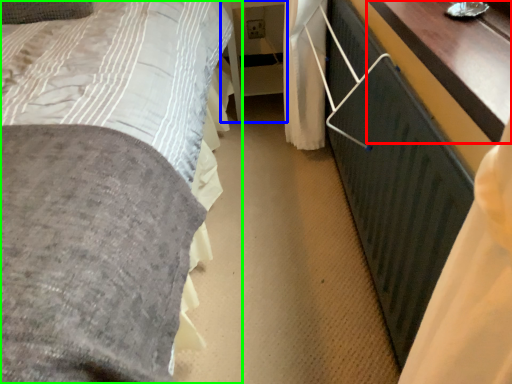
Question: Based on their relative distances, which object is farther from table (highlighted by a red box)? Choose from table (highlighted by a blue box) and bed (highlighted by a green box).

Choices:
 (A) table
 (B) bed

Answer: (A)